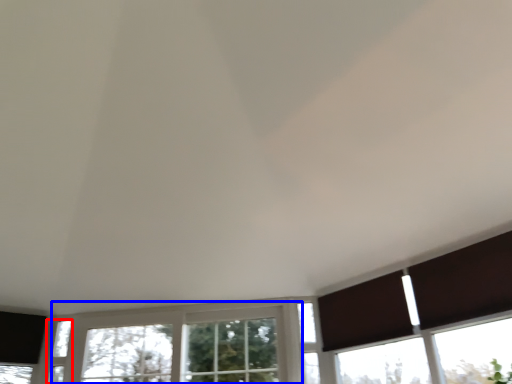
Question: Which point is closer to the camera, window (highlighted by a red box) or window (highlighted by a blue box)?

Choices:
 (A) window
 (B) window

Answer: (B)